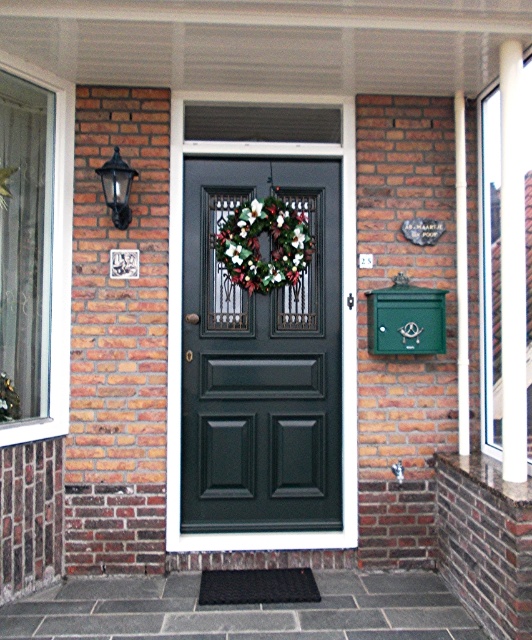
You are a delivery person approaching the house entrance. You need to place a package on the ground near the green painted wood pillar at right. However, you must avoid placing it in front of the green floral wreath at center. Can you do this?

The green floral wreath at center is further to the viewer than green painted wood pillar at right, so placing the package near the green painted wood pillar at right but behind it would avoid blocking the green floral wreath at center.

You are standing in front of the house entrance and want to locate the exact spot where the festive wreath is placed. According to the image, where is the point at coordinates point (261, 358) located?

The point at coordinates point (261, 358) is located on the matte black door at center.